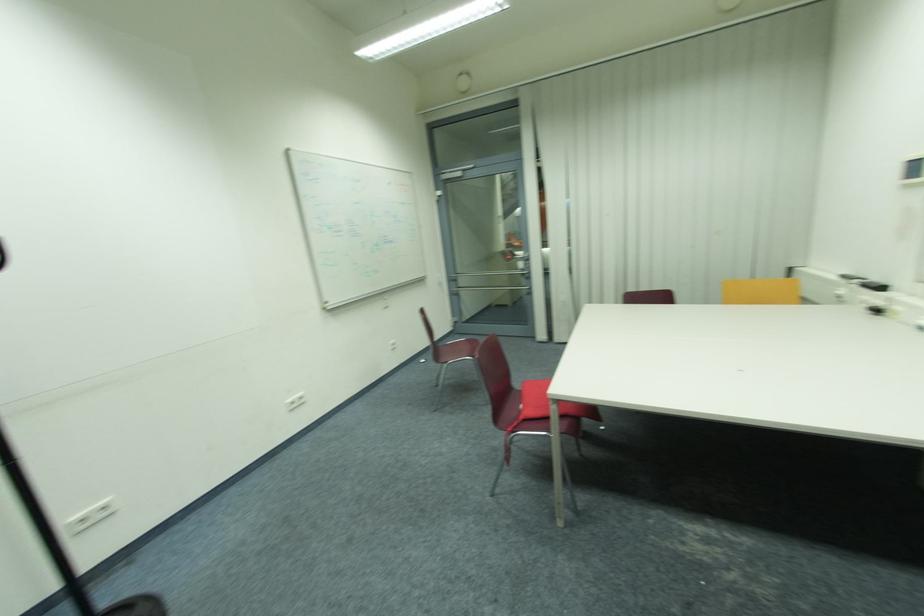
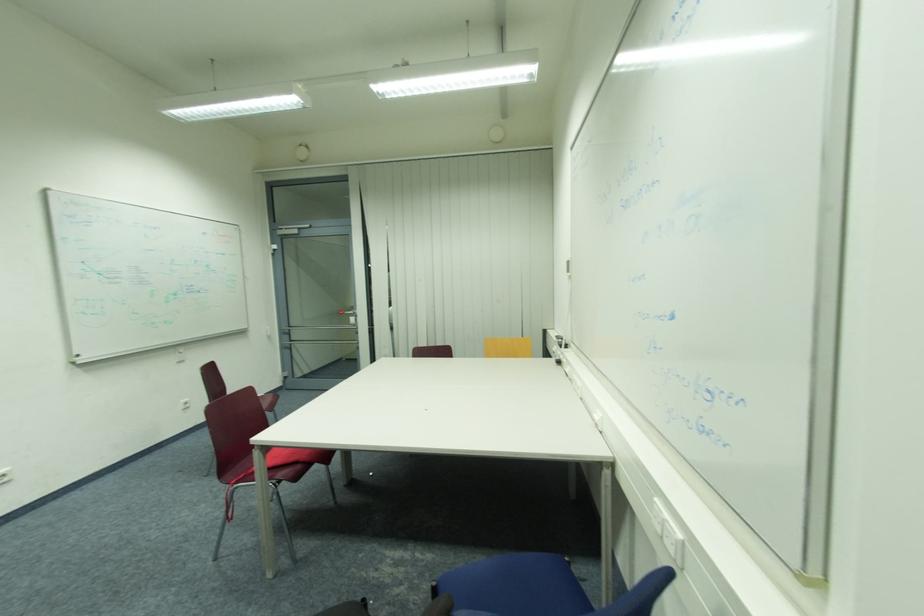
Question: The images are taken continuously from a first-person perspective. In which direction is your viewpoint rotating?

Choices:
 (A) Left
 (B) Right
 (C) Up
 (D) Down

Answer: (B)